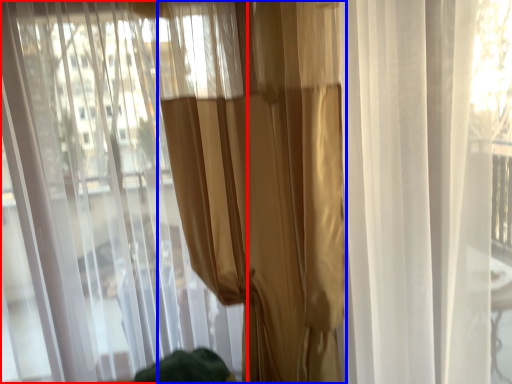
Question: Among these objects, which one is nearest to the camera, curtain (highlighted by a red box) or curtain (highlighted by a blue box)?

Choices:
 (A) curtain
 (B) curtain

Answer: (A)